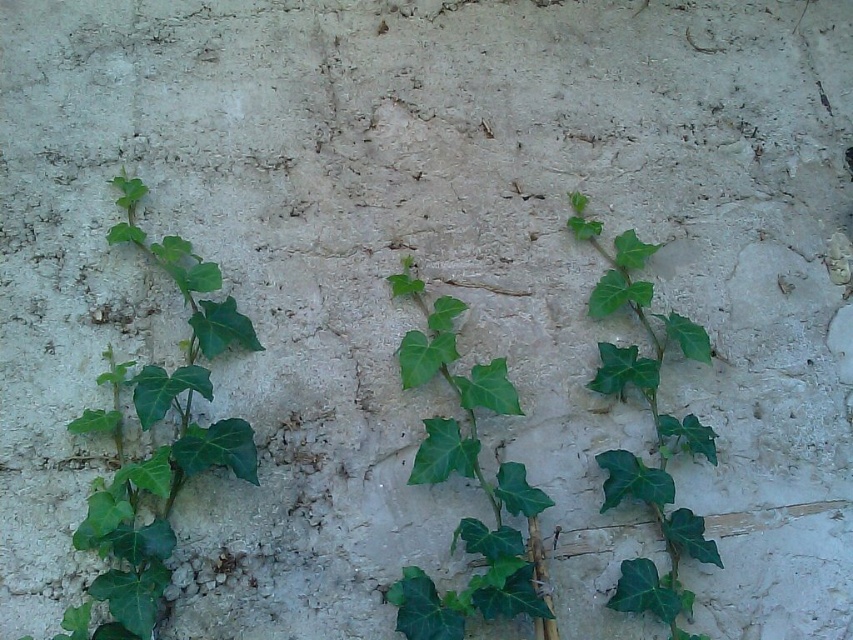
Question: Which of the following is the farthest from the observer?

Choices:
 (A) (126, 184)
 (B) (492, 563)
 (C) (693, 358)

Answer: (C)

Question: Which point is farther to the camera?

Choices:
 (A) green leafy vine at right
 (B) green leafy vine at center
 (C) green leafy vine at left

Answer: (A)

Question: Among these points, which one is nearest to the camera?

Choices:
 (A) tap(618, 250)
 (B) tap(451, 458)

Answer: (B)

Question: Is green leafy vine at left bigger than green leafy vine at center?

Choices:
 (A) no
 (B) yes

Answer: (B)

Question: Is green leafy vine at center in front of green leafy vine at right?

Choices:
 (A) no
 (B) yes

Answer: (B)

Question: Is green leafy vine at left thinner than green leafy vine at right?

Choices:
 (A) no
 (B) yes

Answer: (A)